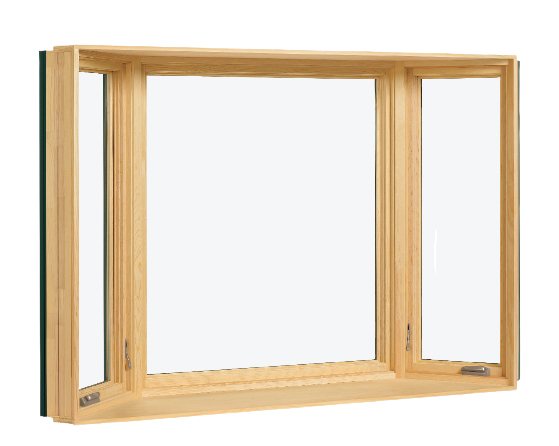
Identify the location of 3 window panes. (94, 256), (253, 321), (453, 271).